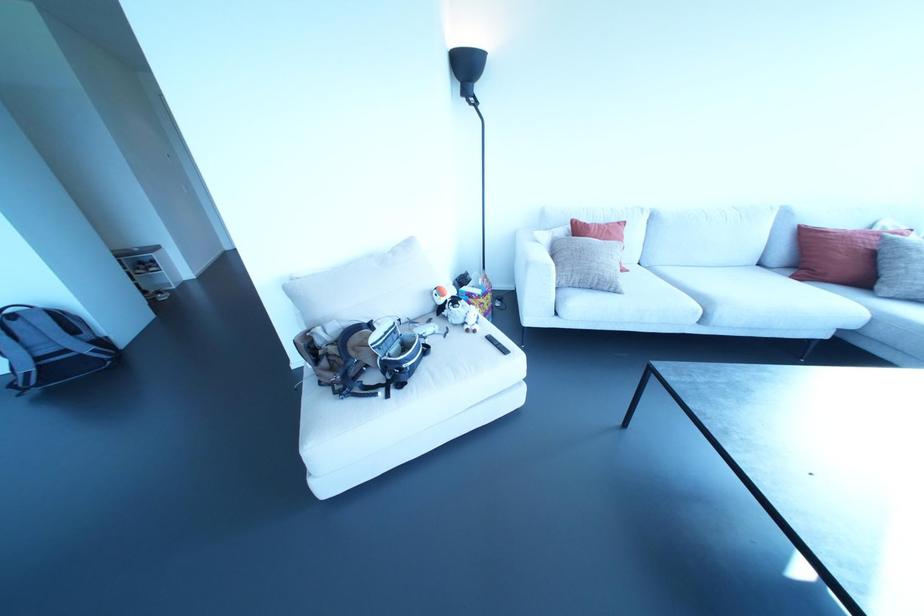
I want to click on grey stuffed toy, so click(460, 314).